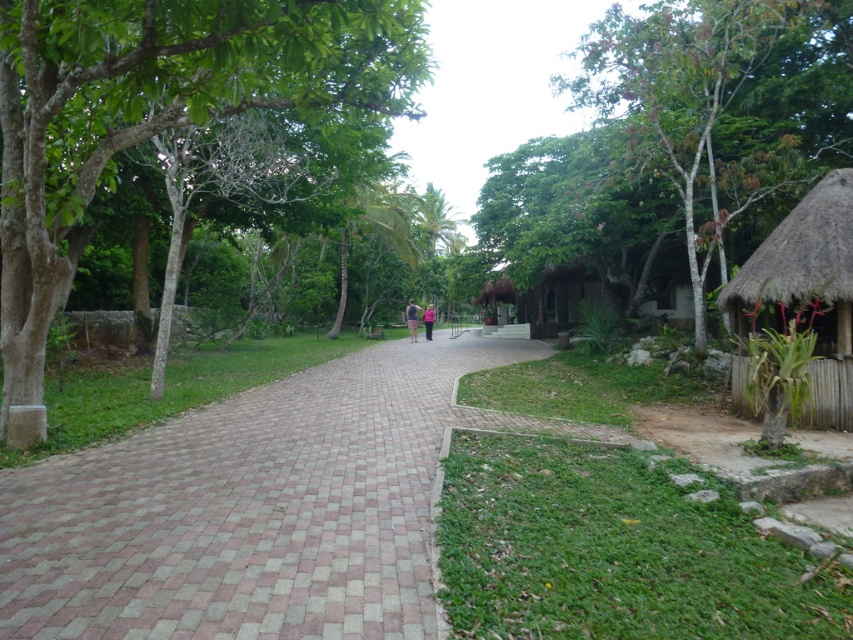
Consider the image. You are a gardener planning to plant a new tree in this area. Considering the space between the green leafy tree at upper right and the thatched bamboo hut at right, which one has a wider spread of branches?

The green leafy tree at upper right has a wider spread of branches than the thatched bamboo hut at right, as its width surpasses the hut.

You are a visitor in this tropical setting and want to reach the thatched bamboo hut at right from the brick paved path at center. Which direction should you head?

The brick paved path at center is to the left of thatched bamboo hut at right, so you should head to the right to reach the thatched bamboo hut at right from the brick paved path at center.

You are standing at the center of the paved brick pathway in the scene. You notice a point marked at coordinates (676, 84). What object does this point indicate?

The point at coordinates (676, 84) indicates the green leafy tree at upper right.